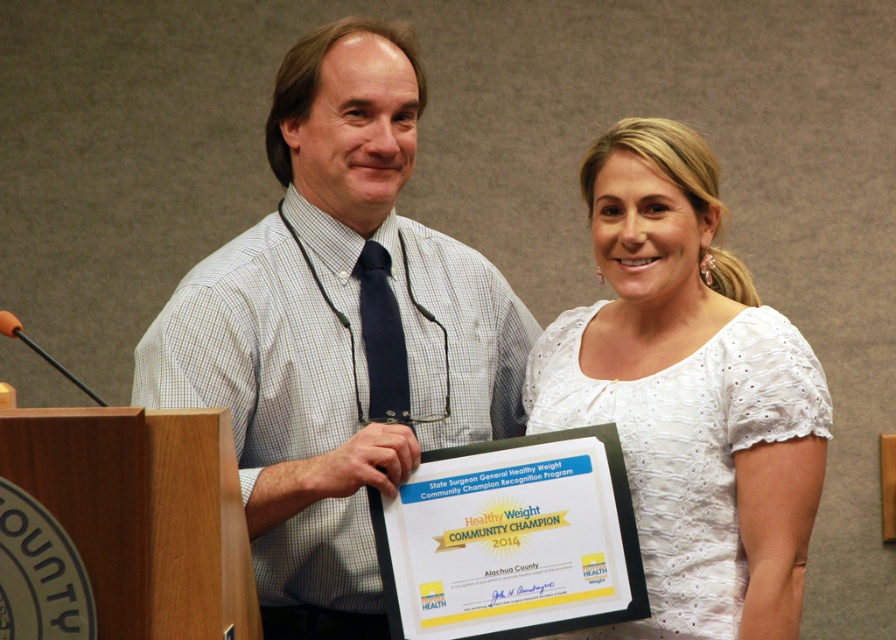
Does white checkered shirt at center have a larger size compared to white lace dress at center?

Indeed, white checkered shirt at center has a larger size compared to white lace dress at center.

Measure the distance between point (302, 102) and camera.

Point (302, 102) is 2.42 meters away from camera.

You are a GUI agent. You are given a task and a screenshot of the screen. Output one action in this format:
    pyautogui.click(x=<x>, y=<y>)
    Task: Click on the white checkered shirt at center
    
    Given the screenshot: What is the action you would take?
    pyautogui.click(x=338, y=324)